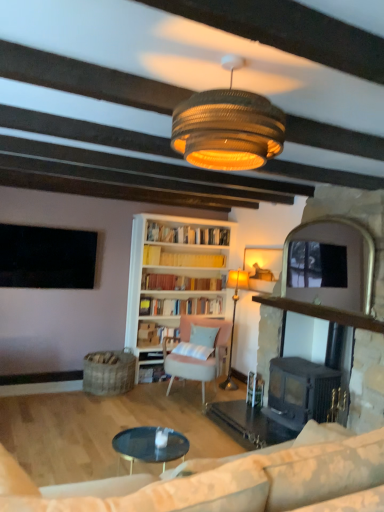
You are a GUI agent. You are given a task and a screenshot of the screen. Output one action in this format:
    pyautogui.click(x=<x>, y=<y>)
    Task: Click on the vacant location below black matte television at upper left (from a real-world perspective)
    
    Given the screenshot: What is the action you would take?
    pyautogui.click(x=38, y=384)